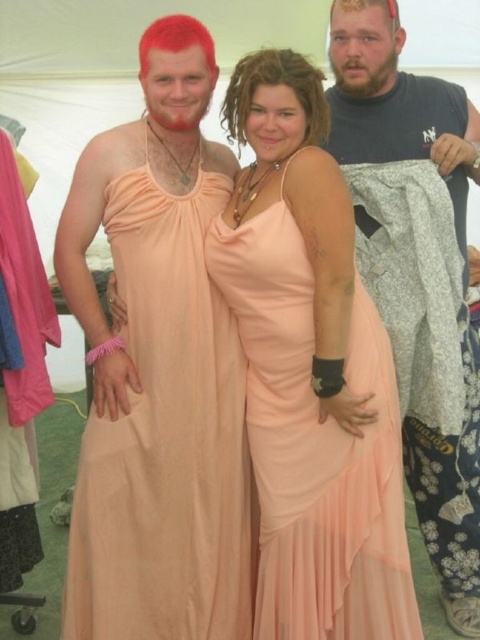
Question: Is peach satin dress at center thinner than peach chiffon dress at center?

Choices:
 (A) yes
 (B) no

Answer: (A)

Question: Considering the real-world distances, which object is farthest from the peach satin dress at center?

Choices:
 (A) gray fabric shirt at right
 (B) peach chiffon dress at center

Answer: (A)

Question: Estimate the real-world distances between objects in this image. Which object is farther from the peach chiffon dress at center?

Choices:
 (A) peach satin dress at center
 (B) gray fabric shirt at right

Answer: (B)

Question: Can you confirm if peach chiffon dress at center is wider than gray fabric shirt at right?

Choices:
 (A) yes
 (B) no

Answer: (A)

Question: Does peach chiffon dress at center appear on the left side of gray fabric shirt at right?

Choices:
 (A) no
 (B) yes

Answer: (B)

Question: Which object appears closest to the camera in this image?

Choices:
 (A) gray fabric shirt at right
 (B) peach chiffon dress at center
 (C) peach satin dress at center

Answer: (B)